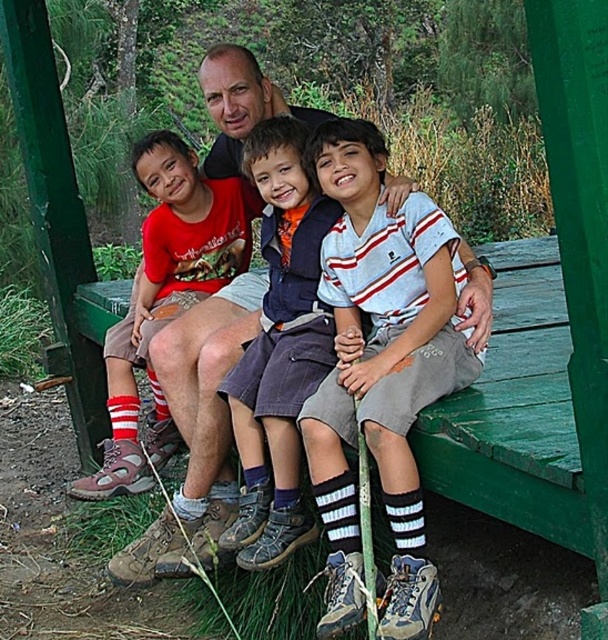
Is white striped socks at lower center taller than matte brown shoes at center?

Yes.

Can you confirm if white striped socks at lower center is positioned to the right of matte brown shoes at center?

Yes, white striped socks at lower center is to the right of matte brown shoes at center.

Which is in front, point (381, 470) or point (170, 572)?

Point (381, 470) is in front.

The image size is (608, 640). I want to click on white striped socks at lower center, so click(x=381, y=371).

Is point (207, 156) less distant than point (271, 344)?

No, it is not.

Measure the distance between point (143,552) and camera.

Point (143,552) and camera are 3.14 meters apart from each other.

Is point (250, 109) positioned after point (304, 152)?

That is True.

Locate an element on the screen. matte brown shoes at center is located at coordinates (206, 397).

Who is taller, striped cotton shirt at center or red cotton shirt at center?

Standing taller between the two is red cotton shirt at center.

Between striped cotton shirt at center and red cotton shirt at center, which one is positioned higher?

Positioned higher is red cotton shirt at center.

Does point (260, 512) come behind point (185, 296)?

No, it is in front of (185, 296).

The image size is (608, 640). I want to click on striped cotton shirt at center, so click(280, 346).